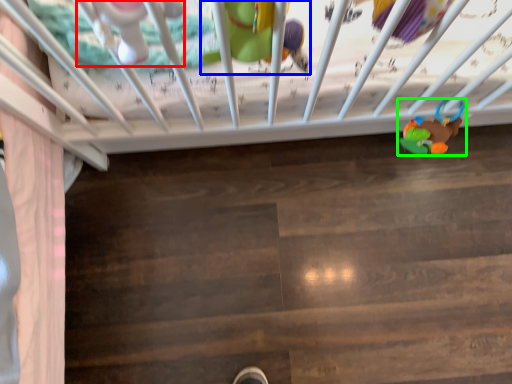
Question: Considering the real-world distances, which object is closest to toy (highlighted by a red box)? toy (highlighted by a blue box) or toy (highlighted by a green box).

Choices:
 (A) toy
 (B) toy

Answer: (A)